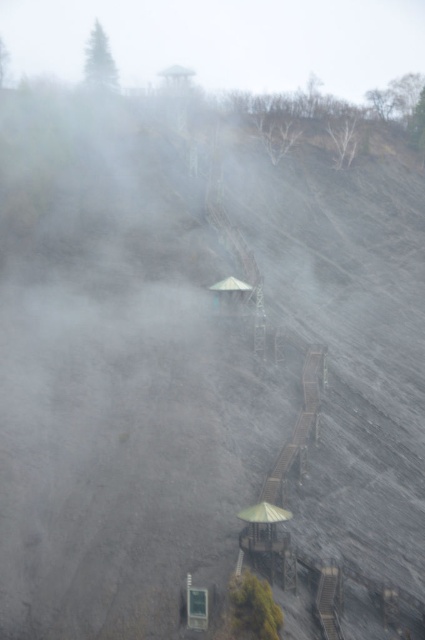
You are a hiker standing at the bottom of the slope, looking up towards the central structure. You see the foggy gray cloud at upper center and the metallic gray hut at center. Which object is higher in elevation?

The foggy gray cloud at upper center is taller than the metallic gray hut at center, so the foggy gray cloud at upper center is higher in elevation.

You are standing at point [218,310] and want to reach point [54,38]. Given the sloped terrain and pathways in the scene, is the path to your destination uphill or downhill?

Since point [54,38] is behind point [218,310], it means you are moving uphill towards it. The pathways in the scene are designed to lead upwards towards the central structure, so the path to point [54,38] is uphill.

You are a hiker trying to reach the metallic gray hut at center from the bottom of the slope. There is a foggy gray cloud at upper center that might obstruct your view. Considering the sizes of the cloud and the hut, which one is more likely to block your path?

The foggy gray cloud at upper center is larger than the metallic gray hut at center, so it is more likely to block your path.